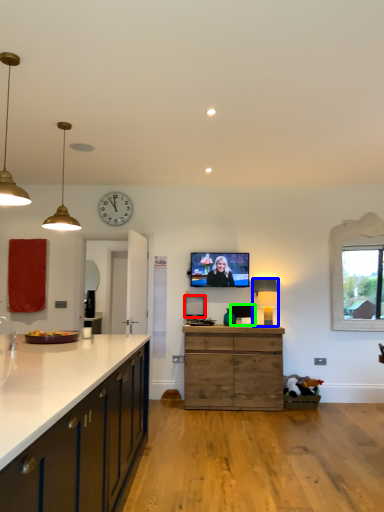
Question: Based on their relative distances, which object is farther from picture frame (highlighted by a red box)? Choose from lamp (highlighted by a blue box) and picture frame (highlighted by a green box).

Choices:
 (A) lamp
 (B) picture frame

Answer: (A)